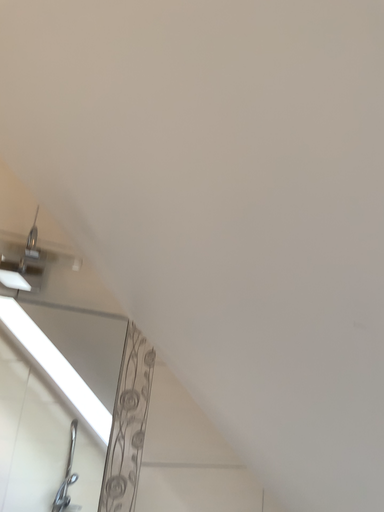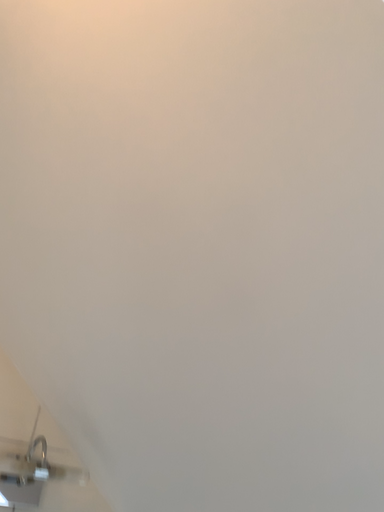
Question: Which way did the camera rotate in the video?

Choices:
 (A) rotated right
 (B) rotated left

Answer: (A)